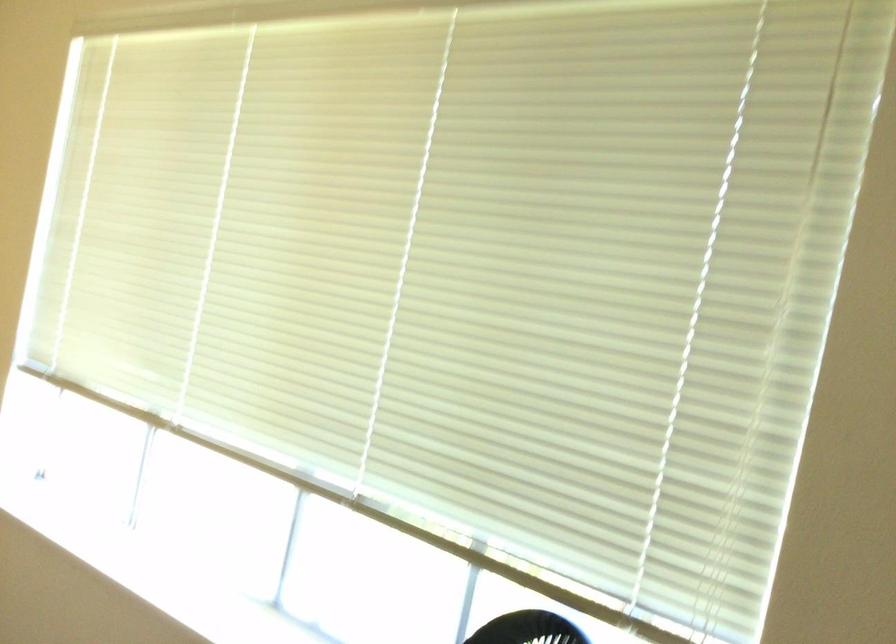
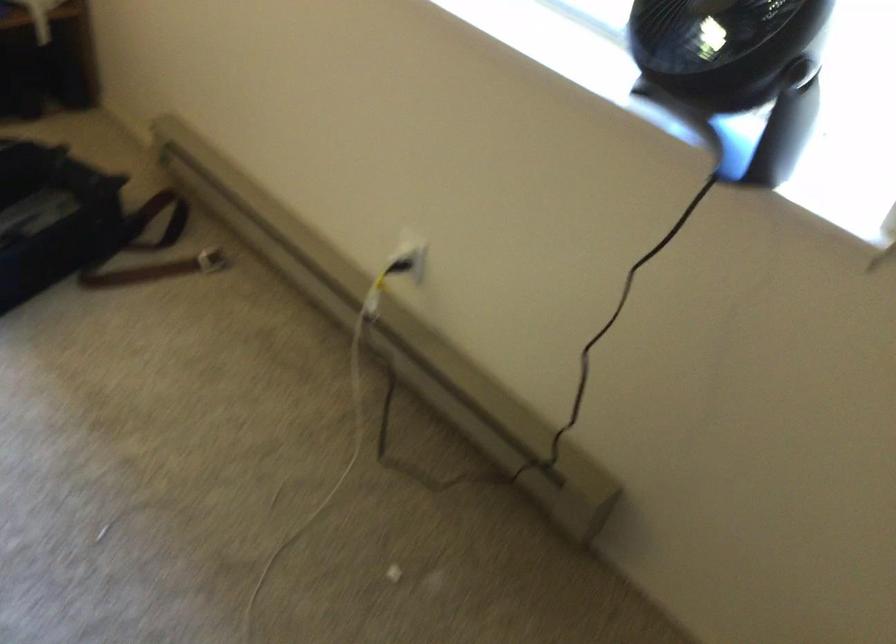
Question: The images are taken continuously from a first-person perspective. In which direction is your viewpoint rotating?

Choices:
 (A) Left
 (B) Right
 (C) Up
 (D) Down

Answer: (D)